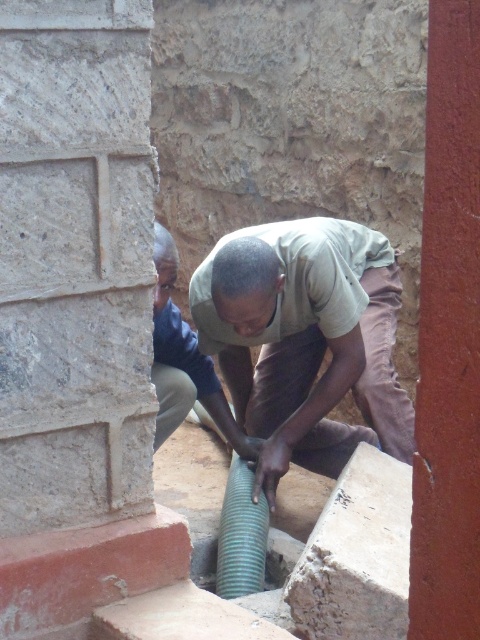
Question: Which object is positioned farthest from the light brown fabric shirt at center?

Choices:
 (A) smooth red pillar at right
 (B) green ribbed pipe at center
 (C) matte green corrugated pipe at center
 (D) green corrugated pipe at center

Answer: (A)

Question: Can you confirm if light brown fabric shirt at center is bigger than green corrugated pipe at center?

Choices:
 (A) yes
 (B) no

Answer: (A)

Question: Which of the following is the closest to the observer?

Choices:
 (A) green ribbed pipe at center
 (B) matte green corrugated pipe at center

Answer: (A)

Question: Which of the following is the farthest from the observer?

Choices:
 (A) matte green corrugated pipe at center
 (B) smooth red pillar at right
 (C) green corrugated pipe at center

Answer: (C)

Question: Can you confirm if light brown fabric shirt at center is smaller than matte green corrugated pipe at center?

Choices:
 (A) no
 (B) yes

Answer: (A)

Question: Can you confirm if matte green corrugated pipe at center is wider than green ribbed pipe at center?

Choices:
 (A) yes
 (B) no

Answer: (A)